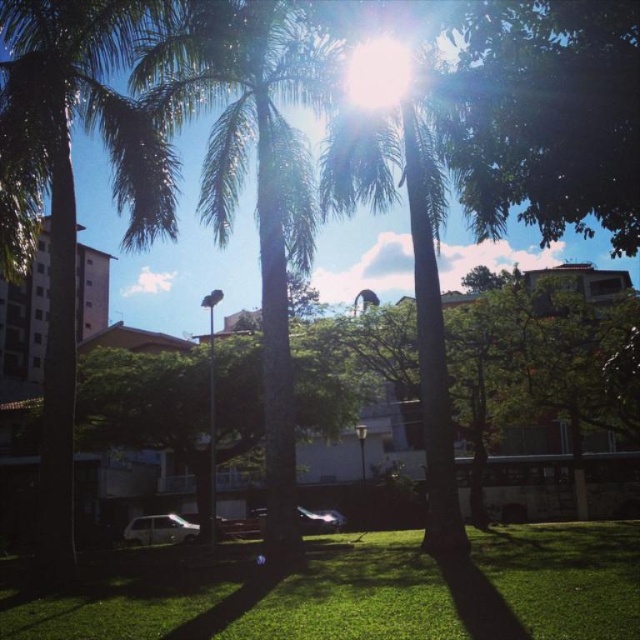
What do you see at coordinates (74, 186) in the screenshot? This screenshot has width=640, height=640. I see `green leafy palm tree at left` at bounding box center [74, 186].

Describe the element at coordinates (74, 186) in the screenshot. I see `green leafy palm tree at left` at that location.

Identify the location of green leafy palm tree at left. (74, 186).

Who is lower down, green grass at lower center or green leafy palm tree at center?

green grass at lower center

The height and width of the screenshot is (640, 640). Find the location of `green grass at lower center`. green grass at lower center is located at coordinates (349, 589).

Which of these two, green grass at lower center or green leafy palm tree at left, stands taller?

green leafy palm tree at left is taller.

Does green grass at lower center appear on the right side of green leafy palm tree at left?

Correct, you'll find green grass at lower center to the right of green leafy palm tree at left.

Between point (157, 572) and point (70, 458), which one is positioned behind?

The point (157, 572) is behind.

Where is `green grass at lower center`? green grass at lower center is located at coordinates (349, 589).